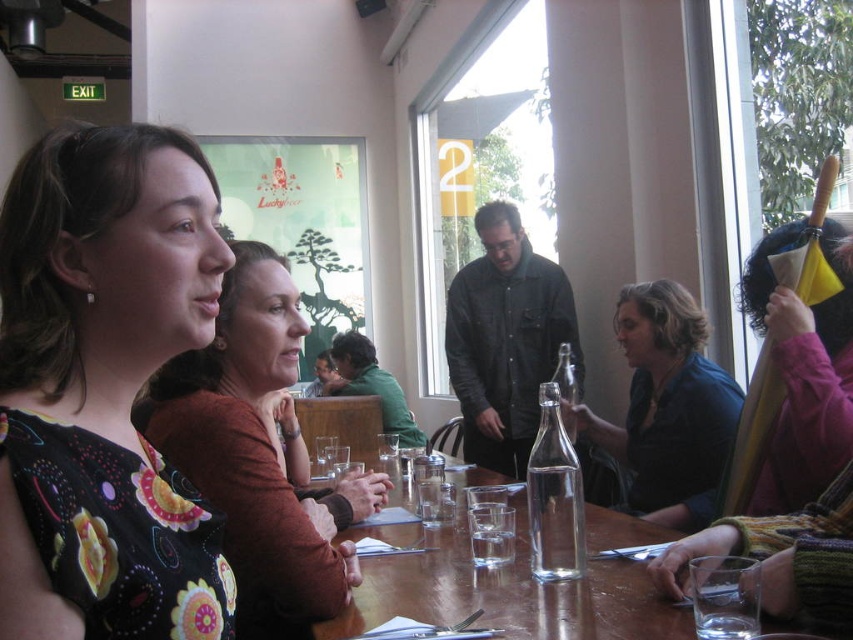
You are sitting at the wooden table in the image and want to reach the point labeled as point (178, 390). Is this point closer to you than the point labeled as point (723, 372)?

Yes, the point (178, 390) is in front of point (723, 372), so it is closer to you.

You are a photographer at the event and want to capture a photo of both the floral print dress at center and the floral dress at center. Which dress should you focus on first if you want to include both in the frame without cropping?

The floral print dress at center is smaller than the floral dress at center, so you should focus on the larger floral dress at center first to ensure it fits properly in the frame.